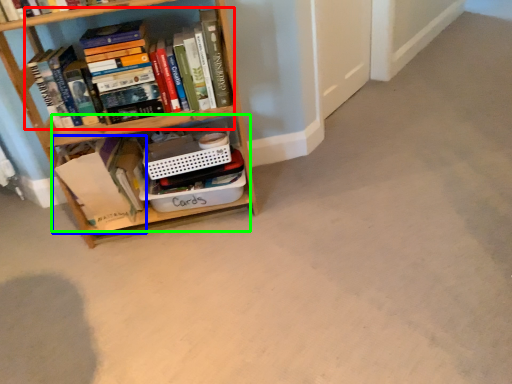
Question: Which object is the farthest from book (highlighted by a red box)? Choose among these: book (highlighted by a blue box) or cabinet (highlighted by a green box).

Choices:
 (A) book
 (B) cabinet

Answer: (A)